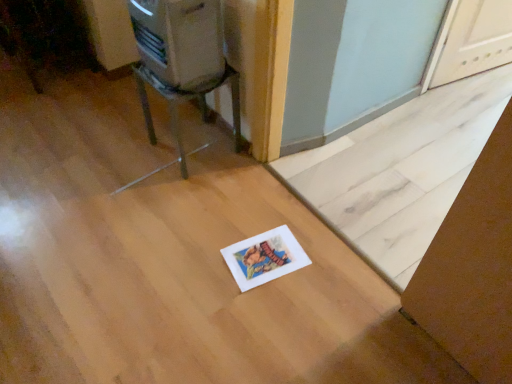
Question: From a real-world perspective, relative to metallic silver appliance at upper left, is metallic silver chair at upper left vertically above or below?

Choices:
 (A) above
 (B) below

Answer: (B)

Question: Does point (232, 127) appear closer or farther from the camera than point (206, 43)?

Choices:
 (A) closer
 (B) farther

Answer: (B)

Question: Which is nearer to the metallic silver chair at upper left?

Choices:
 (A) white paper at lower center
 (B) metallic silver appliance at upper left

Answer: (B)

Question: Estimate the real-world distances between objects in this image. Which object is farther from the metallic silver appliance at upper left?

Choices:
 (A) metallic silver chair at upper left
 (B) white paper at lower center

Answer: (B)